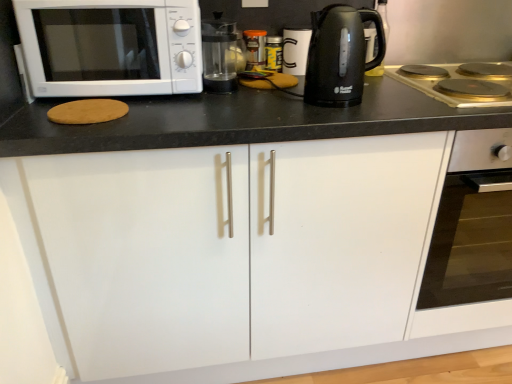
You are a GUI agent. You are given a task and a screenshot of the screen. Output one action in this format:
    pyautogui.click(x=<x>, y=<y>)
    Task: Click on the vacant space in black glossy electric kettle at upper right (from a real-world perspective)
    This screenshot has height=384, width=512.
    Given the screenshot: What is the action you would take?
    point(357,101)